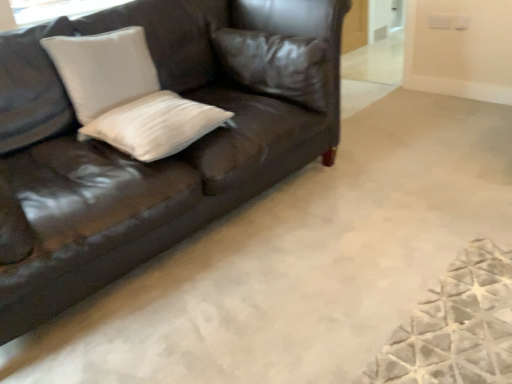
The width and height of the screenshot is (512, 384). What are the coordinates of `spots to the right of shiny brown leather couch at upper left` in the screenshot? It's located at (382, 194).